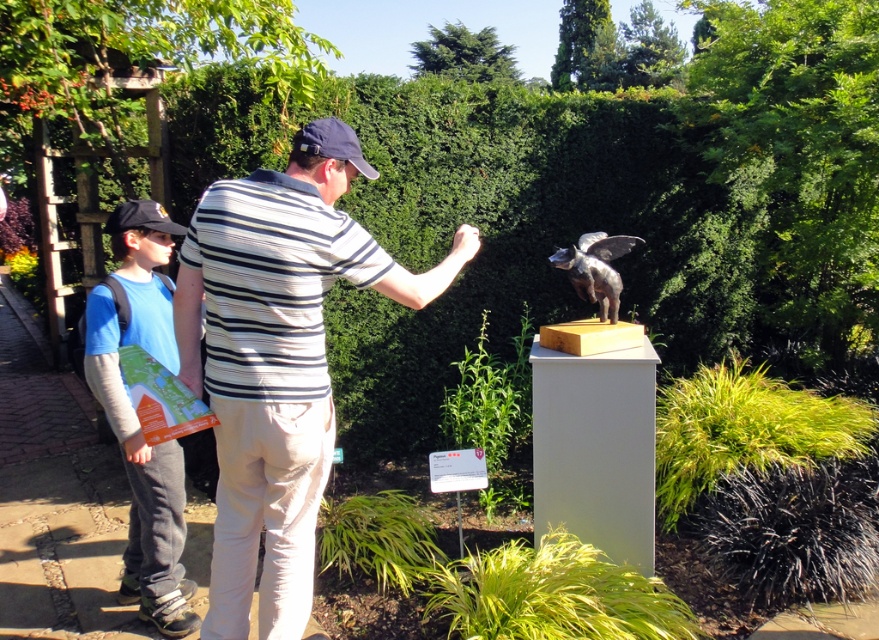
Question: Which point is farther to the camera?

Choices:
 (A) black fabric baseball cap at left
 (B) blue fabric map at left
 (C) striped cotton shirt at center
 (D) polished bronze winged animal at center

Answer: (D)

Question: Among these points, which one is farthest from the camera?

Choices:
 (A) (318, 124)
 (B) (142, 444)
 (C) (172, 227)

Answer: (C)

Question: Does striped cotton shirt at center have a greater width compared to polished bronze winged animal at center?

Choices:
 (A) yes
 (B) no

Answer: (A)

Question: Is striped cotton shirt at center thinner than black fabric baseball cap at left?

Choices:
 (A) yes
 (B) no

Answer: (B)

Question: Is polished bronze winged animal at center wider than black fabric baseball cap at left?

Choices:
 (A) no
 (B) yes

Answer: (B)

Question: Among these objects, which one is farthest from the camera?

Choices:
 (A) black fabric baseball cap at upper center
 (B) blue fabric map at left
 (C) polished bronze winged animal at center

Answer: (C)